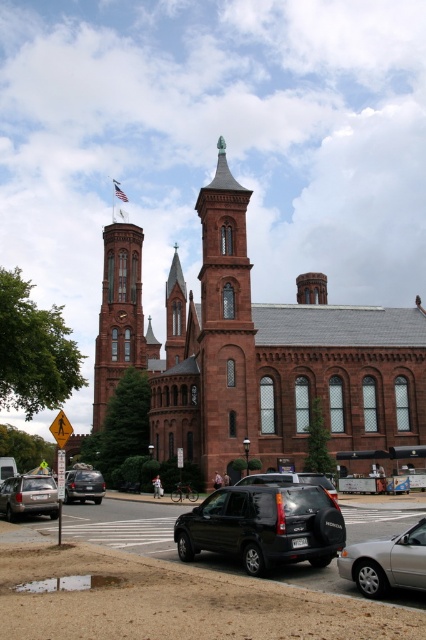
You are a pedestrian approaching the historic building and see the smooth brick tower at center and the yellow reflective plastic pedestrian crossing sign at lower left. Which object is higher from the ground?

The smooth brick tower at center is located above the yellow reflective plastic pedestrian crossing sign at lower left, so it is higher from the ground.

You are a delivery person who needs to park your vehicle in the parking lot behind the historic building. You have a silver metallic sedan at lower right and a black matte suv at lower center. Which vehicle will require more space to park?

The black matte suv at lower center is bigger than the silver metallic sedan at lower right, so it will require more space to park.